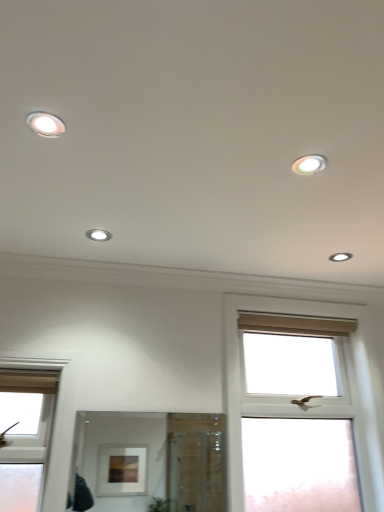
Question: Is white glossy light fixture at upper right, which is the first dot from front to back, turned away from white glossy light fixture at center, the second dot positioned from the back?

Choices:
 (A) yes
 (B) no

Answer: (B)

Question: Does white glossy light fixture at upper right, which appears as the second dot when viewed from the left, come in front of white glossy light fixture at center, which ranks as the 2th dot in top-to-bottom order?

Choices:
 (A) no
 (B) yes

Answer: (B)

Question: Does white glossy light fixture at upper right, marked as the third dot in a bottom-to-top arrangement, have a lesser width compared to white glossy light fixture at center, the third dot from the right?

Choices:
 (A) yes
 (B) no

Answer: (A)

Question: Does white glossy light fixture at upper right, the third dot when ordered from back to front, have a smaller size compared to white glossy light fixture at center, which appears as the second dot when ordered from the bottom?

Choices:
 (A) no
 (B) yes

Answer: (B)

Question: Can you confirm if white glossy light fixture at upper right, marked as the third dot in a bottom-to-top arrangement, is wider than white glossy light fixture at center, the 2th dot when ordered from front to back?

Choices:
 (A) no
 (B) yes

Answer: (A)

Question: Is white glossy light fixture at upper right, the 1th dot positioned from the top, to the left of white glossy light fixture at center, which is the 1th dot from left to right, from the viewer's perspective?

Choices:
 (A) yes
 (B) no

Answer: (B)

Question: From the image's perspective, is clear glass mirror at center above white glossy light fixture at upper right, the 1th dot positioned from the top?

Choices:
 (A) no
 (B) yes

Answer: (A)

Question: Is the position of clear glass mirror at center more distant than that of white glossy light fixture at upper right, marked as the third dot in a bottom-to-top arrangement?

Choices:
 (A) no
 (B) yes

Answer: (B)

Question: Is clear glass mirror at center located outside white glossy light fixture at upper right, which appears as the second dot when viewed from the left?

Choices:
 (A) no
 (B) yes

Answer: (B)

Question: Is clear glass mirror at center positioned with its back to white glossy light fixture at upper right, the 1th dot positioned from the top?

Choices:
 (A) no
 (B) yes

Answer: (A)

Question: Can you confirm if clear glass mirror at center is shorter than white glossy light fixture at upper right, the 1th dot positioned from the top?

Choices:
 (A) yes
 (B) no

Answer: (B)

Question: Does clear glass mirror at center have a greater height compared to white glossy light fixture at upper right, marked as the third dot in a bottom-to-top arrangement?

Choices:
 (A) no
 (B) yes

Answer: (B)

Question: From a real-world perspective, is white glossy light fixture at upper right, the 1th dot positioned from the top, on white glossy light fixture at upper right, which appears as the 1th dot when viewed from the right?

Choices:
 (A) yes
 (B) no

Answer: (A)